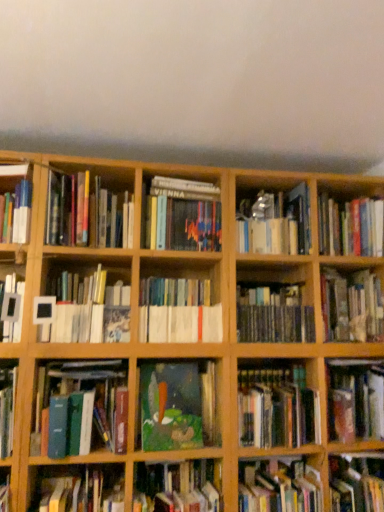
What is the approximate height of oil painting at center, marked as the tenth book in a right-to-left arrangement?

oil painting at center, marked as the tenth book in a right-to-left arrangement, is 13.63 inches in height.

Identify the location of hardcover book at left, which ranks as the 1th book in left-to-right order. Image resolution: width=384 pixels, height=512 pixels. (15, 203).

In the scene shown: Measure the distance between point (x=28, y=241) and camera.

The distance of point (x=28, y=241) from camera is 1.72 meters.

This screenshot has height=512, width=384. Describe the element at coordinates (351, 226) in the screenshot. I see `hardcover book at upper right, the third book in the right-to-left sequence` at that location.

Measure the distance between point (178, 332) and camera.

The depth of point (178, 332) is 1.79 meters.

This screenshot has width=384, height=512. Describe the element at coordinates (355, 399) in the screenshot. I see `hardcover book at center, which ranks as the seventeenth book in left-to-right order` at that location.

Locate an element on the screen. Image resolution: width=384 pixels, height=512 pixels. hardcover book at center, positioned as the 9th book in left-to-right order is located at coordinates (182, 215).

Locate an element on the screen. This screenshot has width=384, height=512. oil painting at center, marked as the tenth book in a right-to-left arrangement is located at coordinates (178, 406).

Does metallic silver book at center, which is counted as the seventh book, starting from the right, contain hardcover books at center, marked as the 8th book in a right-to-left arrangement?

No, metallic silver book at center, which is counted as the seventh book, starting from the right, does not contain hardcover books at center, marked as the 8th book in a right-to-left arrangement.

Image resolution: width=384 pixels, height=512 pixels. What are the coordinates of `the 7th book located beneath the metallic silver book at center, which is counted as the seventh book, starting from the right (from a real-world perspective)` in the screenshot? It's located at (273, 315).

Considering the relative positions of metallic silver book at center, which is counted as the 11th book, starting from the left, and hardcover books at center, the 10th book viewed from the left, in the image provided, is metallic silver book at center, which is counted as the 11th book, starting from the left, to the right of hardcover books at center, the 10th book viewed from the left, from the viewer's perspective?

Correct, you'll find metallic silver book at center, which is counted as the 11th book, starting from the left, to the right of hardcover books at center, the 10th book viewed from the left.

Who is bigger, hardcover book at lower left, the 4th book viewed from the left, or hardcover book at center, which is the 9th book in right-to-left order?

Bigger between the two is hardcover book at lower left, the 4th book viewed from the left.

From a real-world perspective, which object rests below the other?

From a 3D spatial view, hardcover book at lower left, positioned as the 14th book in right-to-left order, is below.

Is point (53, 477) positioned after point (216, 223)?

No, it is in front of (216, 223).

Looking at this image, measure the distance from hardcover books at center, the twelfth book when ordered from right to left, to hardcover book at center, placed as the sixteenth book when sorted from left to right.

hardcover books at center, the twelfth book when ordered from right to left, is 26.57 inches from hardcover book at center, placed as the sixteenth book when sorted from left to right.

Locate an element on the screen. Image resolution: width=384 pixels, height=512 pixels. the 2nd book above the hardcover book at center, placed as the sixteenth book when sorted from left to right (from the image's perspective) is located at coordinates (178, 311).

Is hardcover books at center, positioned as the 6th book in left-to-right order, beside hardcover book at center, placed as the sixteenth book when sorted from left to right?

No, hardcover books at center, positioned as the 6th book in left-to-right order, is not in contact with hardcover book at center, placed as the sixteenth book when sorted from left to right.

Is hardcover books at center, positioned as the 6th book in left-to-right order, wider or thinner than hardcover book at center, positioned as the second book in right-to-left order?

Clearly, hardcover books at center, positioned as the 6th book in left-to-right order, has more width compared to hardcover book at center, positioned as the second book in right-to-left order.

Is point (247, 393) positioned after point (59, 383)?

That is True.

Is the depth of hardcover book at center, acting as the fifth book starting from the right, greater than that of green matte book at center-left, which appears as the third book when viewed from the left?

That is True.

In the scene shown: From the image's perspective, which object appears higher, hardcover book at center, acting as the fifth book starting from the right, or green matte book at center-left, marked as the 15th book in a right-to-left arrangement?

green matte book at center-left, marked as the 15th book in a right-to-left arrangement, is shown above in the image.

Considering the relative sizes of hardcover book at center, acting as the fifth book starting from the right, and green matte book at center-left, which appears as the third book when viewed from the left, in the image provided, is hardcover book at center, acting as the fifth book starting from the right, taller than green matte book at center-left, which appears as the third book when viewed from the left,?

Incorrect, the height of hardcover book at center, acting as the fifth book starting from the right, is not larger of that of green matte book at center-left, which appears as the third book when viewed from the left.

Does hardcover book at center, the 14th book viewed from the left, have a smaller size compared to hardcover book at center, which ranks as the seventeenth book in left-to-right order?

Correct, hardcover book at center, the 14th book viewed from the left, occupies less space than hardcover book at center, which ranks as the seventeenth book in left-to-right order.

Looking at this image, from a real-world perspective, is hardcover book at center, the 4th book when ordered from right to left, positioned above or below hardcover book at center, which is counted as the 1th book, starting from the right?

From a real-world perspective, hardcover book at center, the 4th book when ordered from right to left, is physically below hardcover book at center, which is counted as the 1th book, starting from the right.

Is hardcover book at center, the 14th book viewed from the left, oriented towards hardcover book at center, which ranks as the seventeenth book in left-to-right order?

No, hardcover book at center, the 14th book viewed from the left, does not turn towards hardcover book at center, which ranks as the seventeenth book in left-to-right order.

Is hardcover books at center, marked as the 8th book in a right-to-left arrangement, positioned with its back to hardcover book at center, which is the 13th book from left to right?

hardcover books at center, marked as the 8th book in a right-to-left arrangement, is not turned away from hardcover book at center, which is the 13th book from left to right.

Considering the sizes of hardcover books at center, marked as the 8th book in a right-to-left arrangement, and hardcover book at center, which is the 13th book from left to right, in the image, is hardcover books at center, marked as the 8th book in a right-to-left arrangement, bigger or smaller than hardcover book at center, which is the 13th book from left to right,?

In the image, hardcover books at center, marked as the 8th book in a right-to-left arrangement, appears to be larger than hardcover book at center, which is the 13th book from left to right.

Does hardcover books at center, marked as the 8th book in a right-to-left arrangement, touch hardcover book at center, which is the 13th book from left to right?

No.

Is hardcover books at center, the 10th book viewed from the left, not inside hardcover book at center, acting as the fifth book starting from the right?

Yes, hardcover books at center, the 10th book viewed from the left, is outside of hardcover book at center, acting as the fifth book starting from the right.

Between oil painting at center, marked as the tenth book in a right-to-left arrangement, and hardcover book at center, which is the 9th book in right-to-left order, which one appears on the left side from the viewer's perspective?

oil painting at center, marked as the tenth book in a right-to-left arrangement.

How far apart are oil painting at center, arranged as the 8th book when viewed from the left, and hardcover book at center, which is the 9th book in right-to-left order?

They are 65.45 centimeters apart.

Is oil painting at center, marked as the tenth book in a right-to-left arrangement, touching hardcover book at center, positioned as the 9th book in left-to-right order?

No, oil painting at center, marked as the tenth book in a right-to-left arrangement, is not in contact with hardcover book at center, positioned as the 9th book in left-to-right order.

Is oil painting at center, marked as the tenth book in a right-to-left arrangement, positioned with its back to hardcover book at center, which is the 9th book in right-to-left order?

oil painting at center, marked as the tenth book in a right-to-left arrangement, is not turned away from hardcover book at center, which is the 9th book in right-to-left order.

The image size is (384, 512). What are the coordinates of `book that is the 1st object to the left of the metallic silver book at center, which is counted as the 11th book, starting from the left, starting at the anchor` in the screenshot? It's located at pyautogui.click(x=273, y=315).

Image resolution: width=384 pixels, height=512 pixels. What are the coordinates of `book that is the 9th object located above the hardcover book at lower left, positioned as the 14th book in right-to-left order (from the image's perspective)` in the screenshot? It's located at (182, 215).

Estimate the real-world distances between objects in this image. Which object is further from metallic silver book at center, which is counted as the 11th book, starting from the left, hardcover book at center, the 4th book when ordered from right to left, or oil painting at center, arranged as the 8th book when viewed from the left?

The object further to metallic silver book at center, which is counted as the 11th book, starting from the left, is hardcover book at center, the 4th book when ordered from right to left.

Looking at the image, which one is located further to hardcover books at center, positioned as the 6th book in left-to-right order, oil painting at center, arranged as the 8th book when viewed from the left, or hardcover book at upper left, acting as the 5th book starting from the left?

Based on the image, hardcover book at upper left, acting as the 5th book starting from the left, appears to be further to hardcover books at center, positioned as the 6th book in left-to-right order.

When comparing their distances from hardcover book at left, the 17th book positioned from the right, does white matte picture frame at center-left, the second book in the left-to-right sequence, or hardcover book at lower right, the sixth book when ordered from right to left, seem further?

hardcover book at lower right, the sixth book when ordered from right to left, lies further to hardcover book at left, the 17th book positioned from the right, than the other object.

When comparing their distances from oil painting at center, marked as the tenth book in a right-to-left arrangement, does hardcover book at lower left, positioned as the 14th book in right-to-left order, or hardcover book at center, the 4th book when ordered from right to left, seem further?

hardcover book at center, the 4th book when ordered from right to left, is positioned further to the anchor oil painting at center, marked as the tenth book in a right-to-left arrangement.

Looking at the image, which one is located further to hardcover book at upper right, the 15th book positioned from the left, hardcover book at center, acting as the fifth book starting from the right, or hardcover book at center, which ranks as the seventeenth book in left-to-right order?

Answer: hardcover book at center, acting as the fifth book starting from the right, lies further to hardcover book at upper right, the 15th book positioned from the left, than the other object.

When comparing their distances from hardcover books at center, marked as the 8th book in a right-to-left arrangement, does hardcover book at center, positioned as the 9th book in left-to-right order, or green matte book at center-left, which appears as the third book when viewed from the left, seem closer?

hardcover book at center, positioned as the 9th book in left-to-right order, is closer to hardcover books at center, marked as the 8th book in a right-to-left arrangement.

Considering their positions, is hardcover books at center, the 10th book viewed from the left, positioned closer to hardcover book at center, which ranks as the seventeenth book in left-to-right order, than hardcover book at left, the 17th book positioned from the right?

hardcover books at center, the 10th book viewed from the left, is closer to hardcover book at center, which ranks as the seventeenth book in left-to-right order.

From the image, which object appears to be nearer to oil painting at center, marked as the tenth book in a right-to-left arrangement, hardcover book at center, the 14th book viewed from the left, or white matte picture frame at center-left, the 16th book when ordered from right to left?

white matte picture frame at center-left, the 16th book when ordered from right to left.

Where is `book between hardcover book at lower right, the 12th book from the left, and hardcover book at center, the 14th book viewed from the left`? The image size is (384, 512). book between hardcover book at lower right, the 12th book from the left, and hardcover book at center, the 14th book viewed from the left is located at coordinates (277, 408).

In order to click on book between hardcover book at center, which is the 9th book in right-to-left order, and metallic silver book at center, which is counted as the seventh book, starting from the right, in the horizontal direction in this screenshot , I will do `click(273, 315)`.